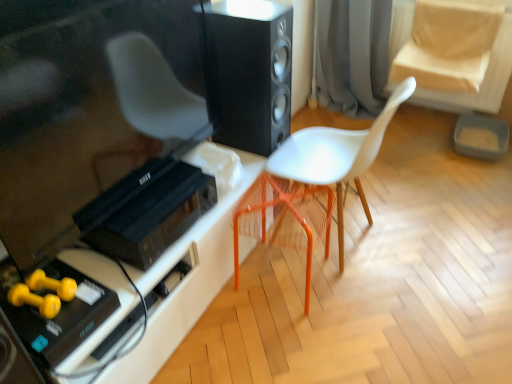
The height and width of the screenshot is (384, 512). In order to click on free point in front of white matte chair at center in this screenshot , I will do `click(355, 318)`.